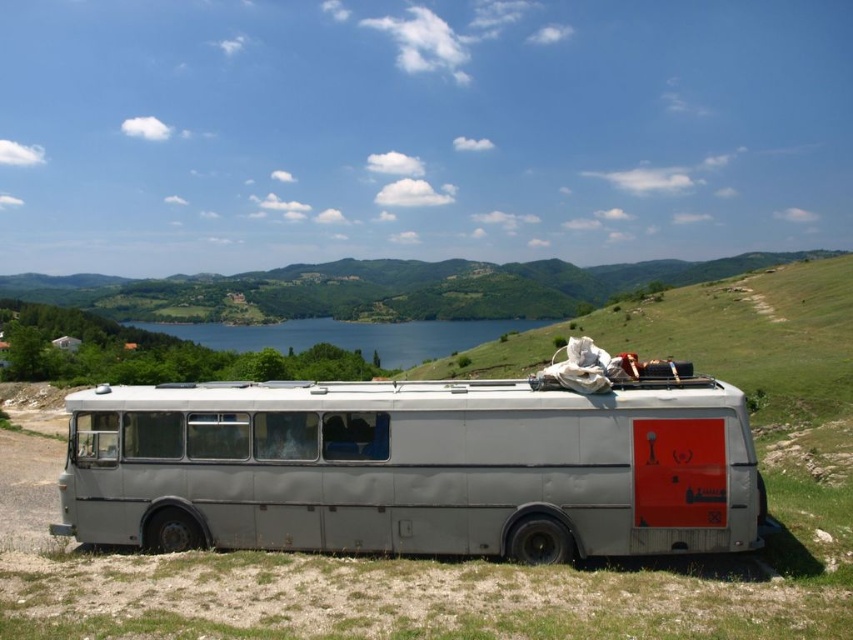
You are planning to take a photo of the gray matte van at center and the blue water at center from a distance. The camera you are using has a maximum focus range of 200 meters. Will you be able to capture both objects clearly in the same photo?

The gray matte van at center is 213.68 meters away from the blue water at center. Since the camera can only focus up to 200 meters, the distance between them exceeds the camera range. Therefore, you cannot capture both objects clearly in the same photo.

You are standing at the base of the grassy hillside where the vintage bus is parked. You see two points marked on the landscape. Which point is closer to you, point (68, 497) or point (260, 324)?

Point (68, 497) is in front of point (260, 324), so it is closer to you.